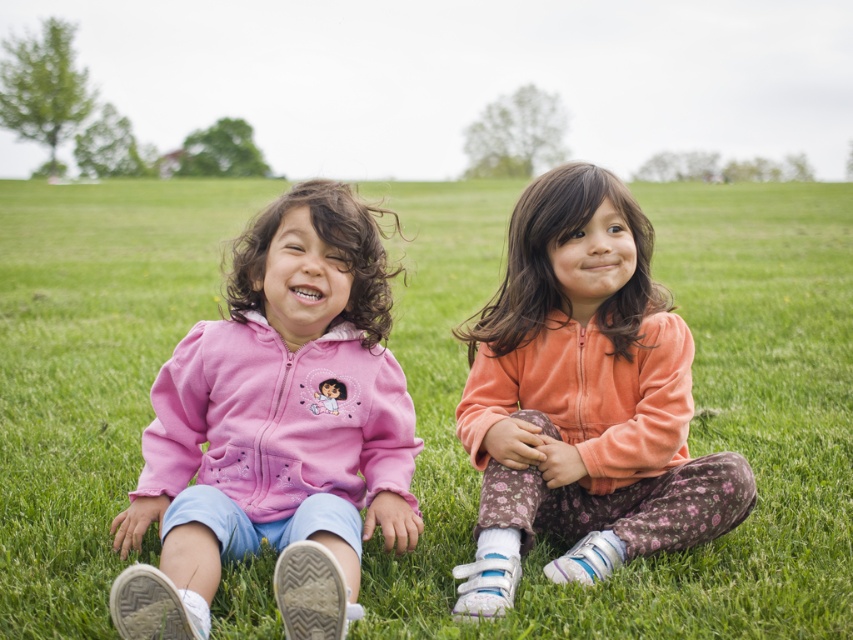
In the scene shown: Is pink fleece jackets at center further to the viewer compared to velvet orange hoodie at center?

Yes, it is.

Can you confirm if pink fleece jackets at center is positioned to the right of velvet orange hoodie at center?

Yes, pink fleece jackets at center is to the right of velvet orange hoodie at center.

Does point (190, 225) lie behind point (592, 506)?

That is True.

I want to click on pink fleece jackets at center, so click(x=689, y=422).

Is pink fleece jacket at left positioned in front of velvet orange hoodie at center?

Yes, pink fleece jacket at left is in front of velvet orange hoodie at center.

Which is more to the right, pink fleece jacket at left or velvet orange hoodie at center?

Positioned to the right is velvet orange hoodie at center.

Which is behind, point (285, 241) or point (631, 440)?

Point (631, 440)

At what (x,y) coordinates should I click in order to perform the action: click on pink fleece jacket at left. Please return your answer as a coordinate pair (x, y). Looking at the image, I should click on (277, 428).

Is pink fleece jackets at center positioned behind pink fleece jacket at left?

That is True.

Between point (744, 608) and point (303, 250), which one is positioned in front?

Point (744, 608)

Identify the location of pink fleece jackets at center. (689, 422).